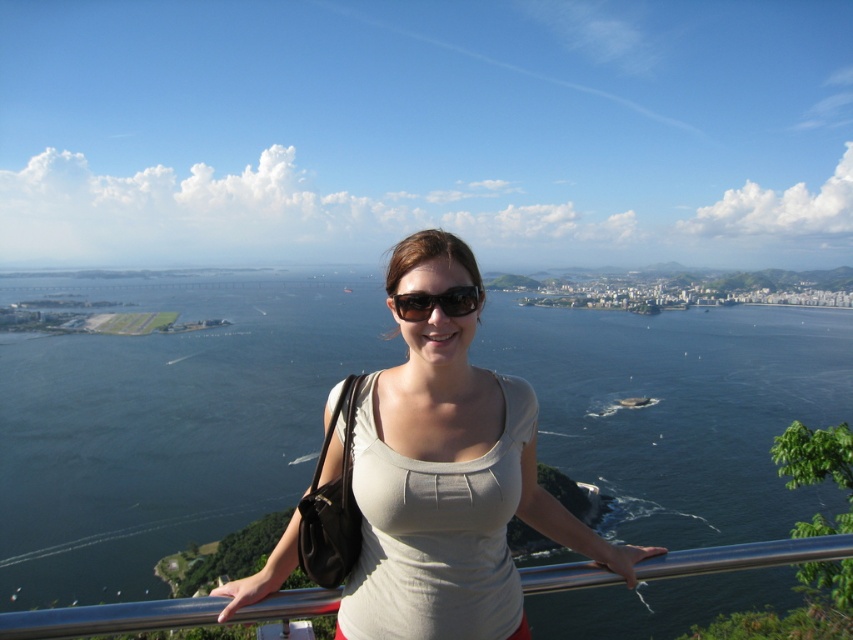
Question: Which object is closer to the camera taking this photo?

Choices:
 (A) stainless steel railing at center
 (B) black plastic sunglasses at center
 (C) white matte tank top at center

Answer: (A)

Question: Considering the real-world distances, which object is closest to the stainless steel railing at center?

Choices:
 (A) black plastic sunglasses at center
 (B) dark blue water at center
 (C) white matte tank top at center

Answer: (C)

Question: Does dark blue water at center appear over stainless steel railing at center?

Choices:
 (A) no
 (B) yes

Answer: (B)

Question: Can you confirm if dark blue water at center is positioned below black plastic sunglasses at center?

Choices:
 (A) yes
 (B) no

Answer: (A)

Question: Where is dark blue water at center located in relation to white matte tank top at center in the image?

Choices:
 (A) right
 (B) left

Answer: (B)

Question: Which object is farther from the camera taking this photo?

Choices:
 (A) black plastic sunglasses at center
 (B) white matte tank top at center

Answer: (A)